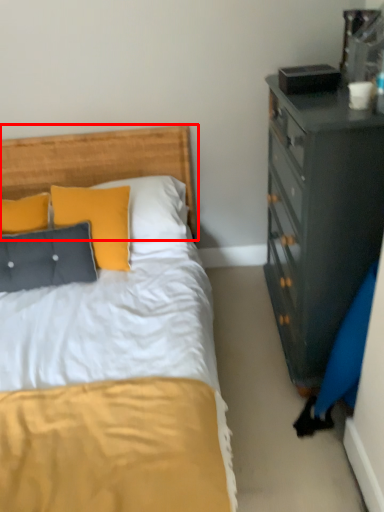
Question: Considering the relative positions of headboard (annotated by the red box) and pillow in the image provided, where is headboard (annotated by the red box) located with respect to the staircase?

Choices:
 (A) left
 (B) right

Answer: (B)